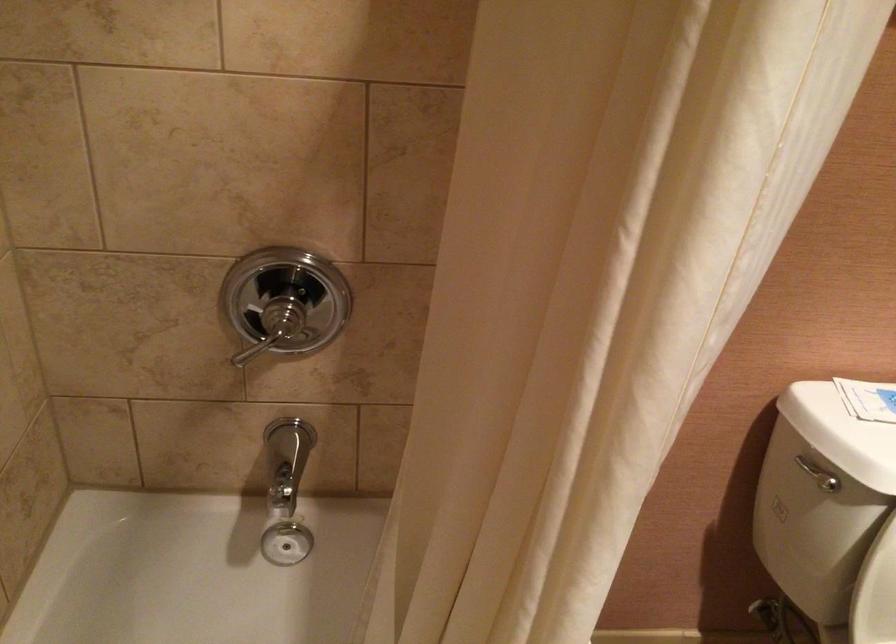
What do you see at coordinates (819, 475) in the screenshot? The height and width of the screenshot is (644, 896). I see `the toilet flush handle` at bounding box center [819, 475].